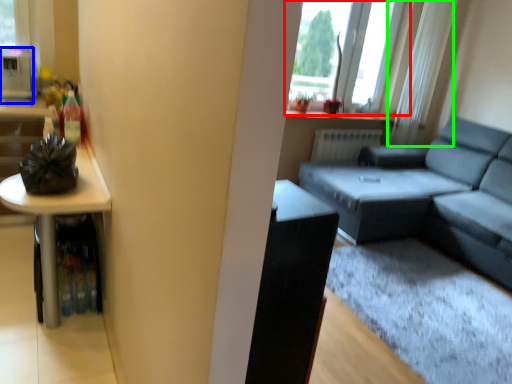
Question: Which is farther away from window (highlighted by a red box)? appliance (highlighted by a blue box) or curtain (highlighted by a green box)?

Choices:
 (A) appliance
 (B) curtain

Answer: (A)